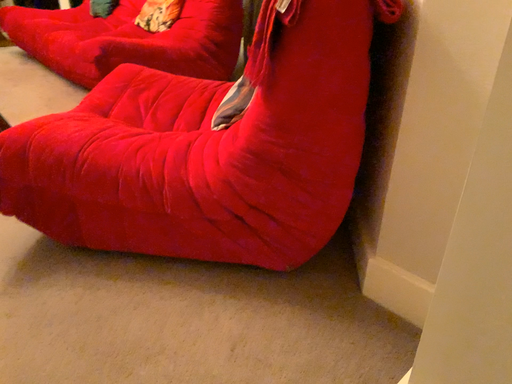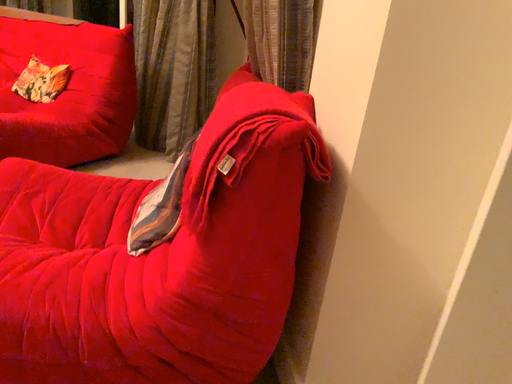
Question: How did the camera likely rotate when shooting the video?

Choices:
 (A) rotated right
 (B) rotated left

Answer: (A)